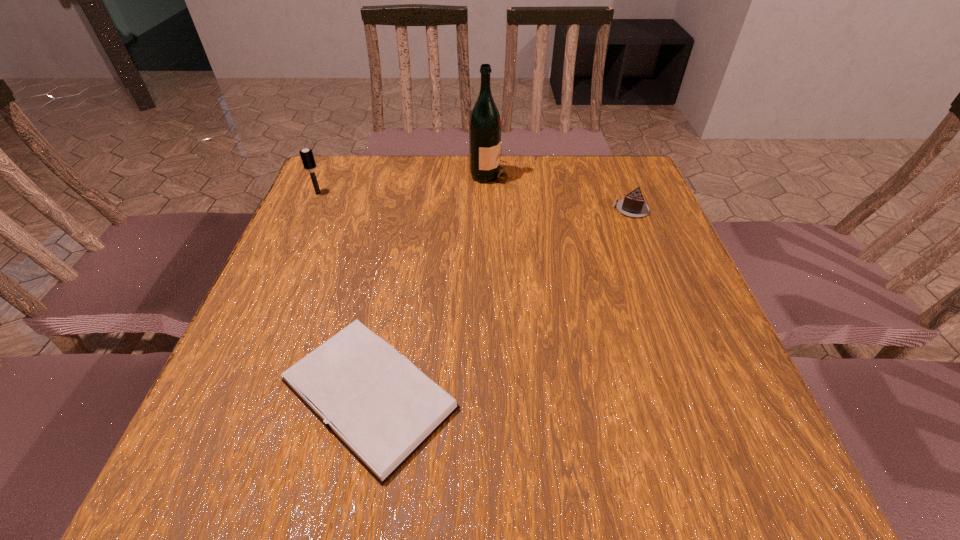
In order to click on the tallest object in this screenshot , I will do `click(485, 124)`.

Locate an element on the screen. the second object from right to left is located at coordinates (485, 124).

At what (x,y) coordinates should I click in order to perform the action: click on hairbrush. Please return your answer as a coordinate pair (x, y). The height and width of the screenshot is (540, 960). Looking at the image, I should click on (307, 157).

You are a GUI agent. You are given a task and a screenshot of the screen. Output one action in this format:
    pyautogui.click(x=<x>, y=<y>)
    Task: Click on the third nearest object
    This screenshot has width=960, height=540.
    Given the screenshot: What is the action you would take?
    pyautogui.click(x=307, y=157)

This screenshot has width=960, height=540. In order to click on chocolate cake in this screenshot , I will do `click(632, 205)`.

Locate an element on the screen. This screenshot has width=960, height=540. the third farthest object is located at coordinates point(632,205).

The height and width of the screenshot is (540, 960). Find the location of `the nearest object`. the nearest object is located at coordinates (376, 402).

Find the location of a particular element. The image size is (960, 540). hardback book is located at coordinates (376, 402).

What are the coordinates of `vacant space located on the right of the second object from right to left` in the screenshot? It's located at (593, 174).

At what (x,y) coordinates should I click in order to perform the action: click on blank space located on the right of the hairbrush. Please return your answer as a coordinate pair (x, y). The width and height of the screenshot is (960, 540). Looking at the image, I should click on (456, 193).